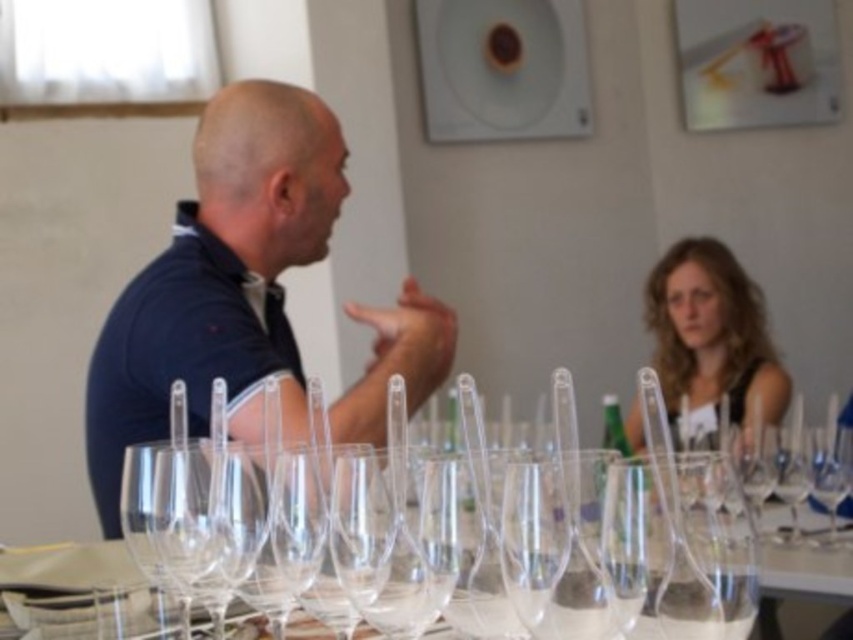
Is dark blue shirt at left to the right of blonde hair at upper right from the viewer's perspective?

No, dark blue shirt at left is not to the right of blonde hair at upper right.

Who is more distant from viewer, (234, 170) or (663, 376)?

The point (663, 376) is more distant.

Which is behind, point (235, 179) or point (746, 285)?

Positioned behind is point (746, 285).

In order to click on dark blue shirt at left in this screenshot , I will do `click(219, 282)`.